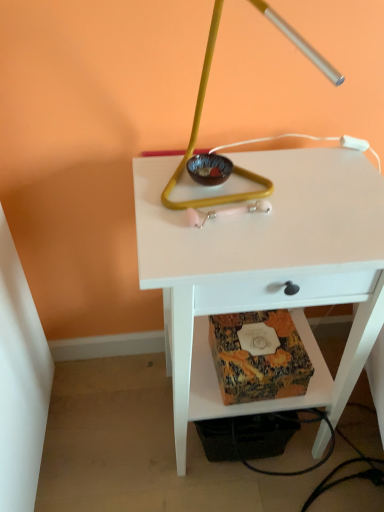
Where is `vacant area located to the right-hand side of matte brown glass bowl at center`? vacant area located to the right-hand side of matte brown glass bowl at center is located at coordinates (295, 186).